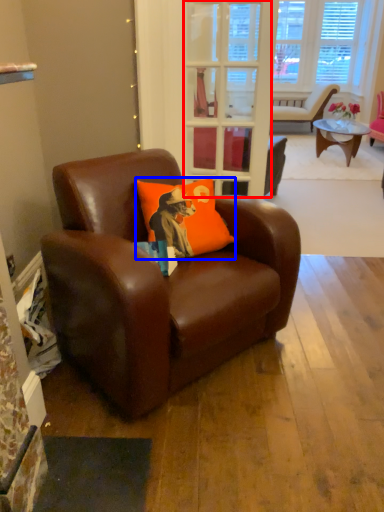
Question: Which object appears farthest to the camera in this image, glass door (highlighted by a red box) or pillow (highlighted by a blue box)?

Choices:
 (A) glass door
 (B) pillow

Answer: (A)